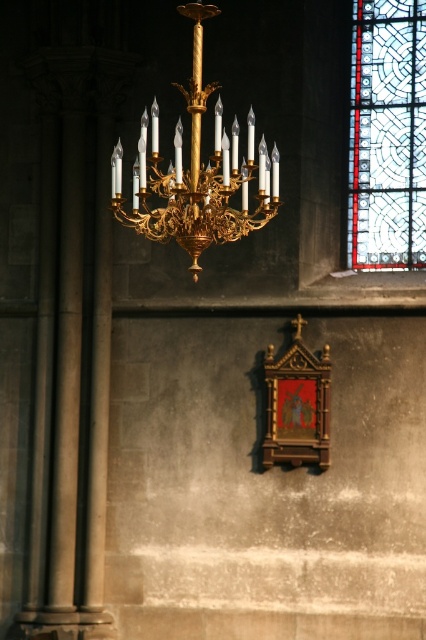
Consider the image. Measure the distance between point (371,196) and camera.

Point (371,196) and camera are 85.97 meters apart from each other.

The height and width of the screenshot is (640, 426). Describe the element at coordinates (386, 134) in the screenshot. I see `stained glass window at upper right` at that location.

The image size is (426, 640). I want to click on stained glass window at upper right, so click(x=386, y=134).